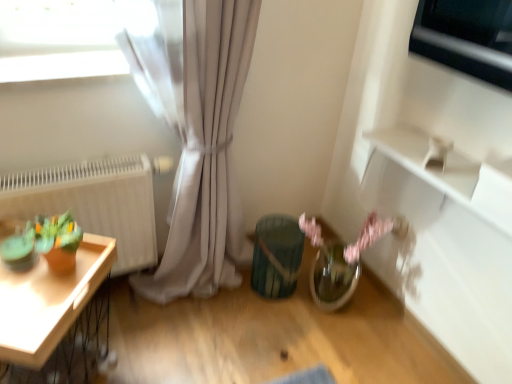
Question: From a real-world perspective, is white matte radiator at left positioned above or below wooden tray at left?

Choices:
 (A) above
 (B) below

Answer: (A)

Question: Considering the positions of white matte radiator at left and wooden tray at left in the image, is white matte radiator at left bigger or smaller than wooden tray at left?

Choices:
 (A) small
 (B) big

Answer: (A)

Question: Considering the real-world distances, which object is closest to the wooden tray at left?

Choices:
 (A) teal textured vase at center
 (B) metallic silver window at upper right
 (C) white matte radiator at left

Answer: (C)

Question: Which object is the farthest from the teal textured vase at center?

Choices:
 (A) metallic silver window at upper right
 (B) white matte radiator at left
 (C) wooden tray at left

Answer: (A)